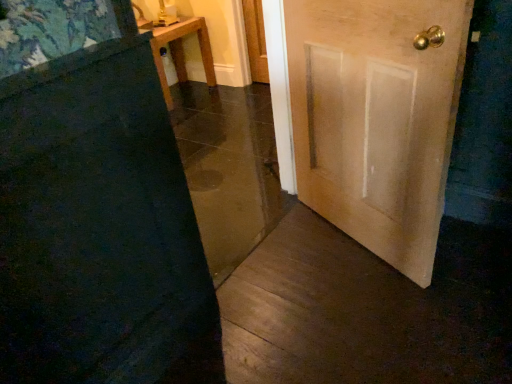
Question: Considering the positions of wooden table at upper left and wooden door at center, the 1th door in the left-to-right sequence, in the image, is wooden table at upper left bigger or smaller than wooden door at center, the 1th door in the left-to-right sequence,?

Choices:
 (A) big
 (B) small

Answer: (A)

Question: From the image's perspective, relative to wooden door at center, marked as the 2th door in a right-to-left arrangement, is wooden table at upper left above or below?

Choices:
 (A) below
 (B) above

Answer: (B)

Question: Which object is positioned farthest from the wooden table at upper left?

Choices:
 (A) wooden door at center, marked as the 2th door in a right-to-left arrangement
 (B) light brown wooden door at right, which is the 1th door in right-to-left order

Answer: (A)

Question: Based on their relative distances, which object is farther from the light brown wooden door at right, the second door viewed from the left?

Choices:
 (A) wooden door at center, marked as the 2th door in a right-to-left arrangement
 (B) wooden table at upper left

Answer: (B)